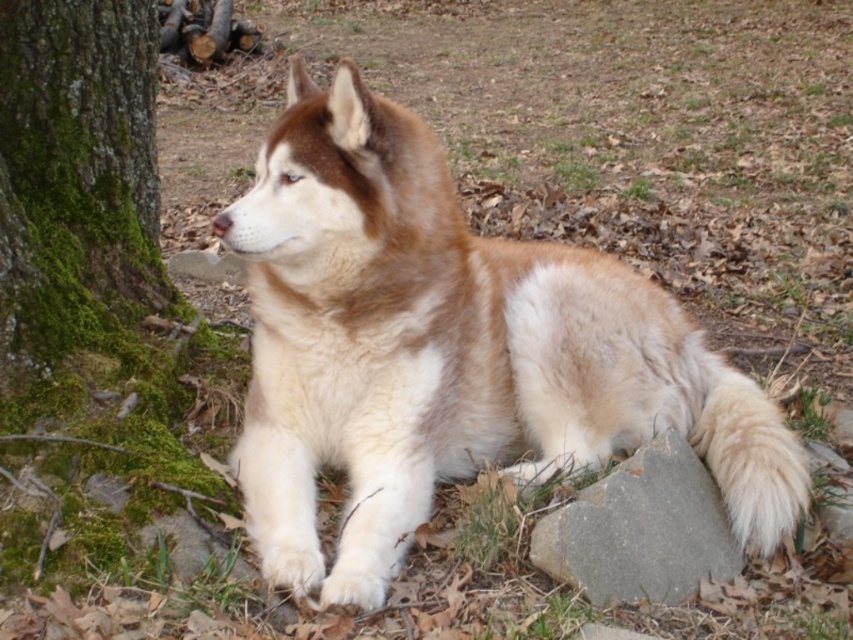
You are a photographer trying to capture the perfect shot of the fuzzy fur dog at center. Based on its position relative to the tree trunk and the scattered leaves, where would you position your camera to ensure the dog is centered in the frame?

The fuzzy fur dog at center is already positioned at the center of the image coordinates at point (450, 352), so positioning the camera to center the dog would require aligning the frame to this coordinate point.

You are a photographer standing at a certain distance from the fuzzy fur dog at center. You want to take a portrait of the dog without any background distractions. If your camera has a depth of field that can only focus clearly on objects within a 5 feet range from the lens, will the background elements like the tree trunk, moss, leaves, and rocks be out of focus?

The fuzzy fur dog at center is 5.83 feet from the camera. Since the depth of field can only focus within 5 feet, the dog is slightly beyond the optimal focus range. However, the background elements like the tree trunk, moss, leaves, and rocks are farther away than the dog. This means they would be even more out of focus, creating a blurred background while the dog remains the main subject, though slightly out of focus itself.

You are a photographer setting up a shot of the fuzzy fur dog at center and the gray smooth stone at lower right. If you want to frame both subjects so they appear balanced in size, which object should you move closer to the camera?

The gray smooth stone at lower right should be moved closer to the camera because the fuzzy fur dog at center is wider than the gray smooth stone at lower right, so bringing the smaller stone forward would help balance their apparent sizes.